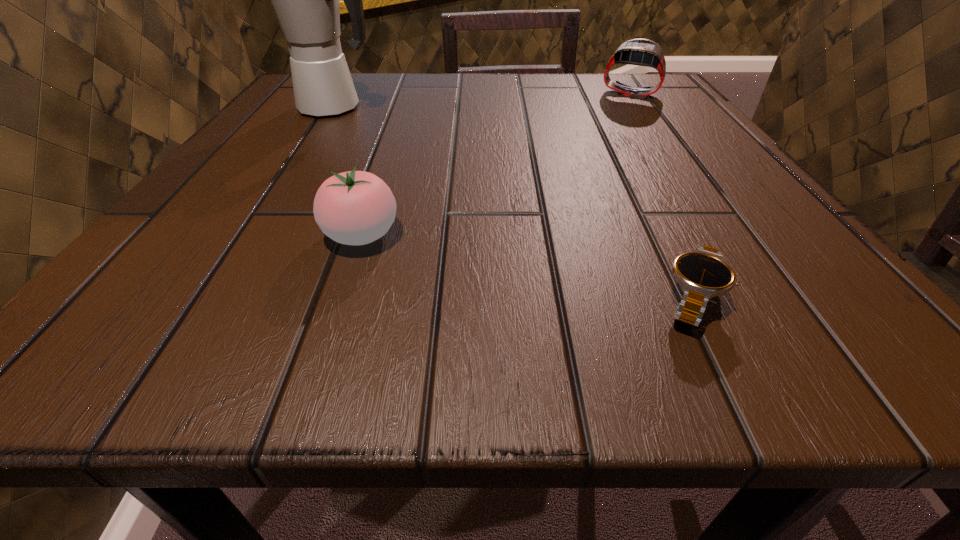
Where is `free space at the near right corner of the desktop`? Image resolution: width=960 pixels, height=540 pixels. free space at the near right corner of the desktop is located at coordinates [x=760, y=299].

The image size is (960, 540). In order to click on free space between the coffeepot and the taller watch in this screenshot , I will do `click(482, 100)`.

You are a GUI agent. You are given a task and a screenshot of the screen. Output one action in this format:
    pyautogui.click(x=<x>, y=<y>)
    Task: Click on the free space between the tomato and the tallest object
    Image resolution: width=960 pixels, height=540 pixels.
    Given the screenshot: What is the action you would take?
    pyautogui.click(x=348, y=171)

Find the location of a particular element. free space between the tallest object and the tomato is located at coordinates (348, 171).

The image size is (960, 540). I want to click on vacant space that's between the tallest object and the tomato, so click(348, 171).

Locate an element on the screen. empty space that is in between the shortest object and the tomato is located at coordinates (527, 267).

Identify the location of unoccupied area between the coffeepot and the tomato. (348, 171).

At what (x,y) coordinates should I click in order to perform the action: click on blank region between the farther watch and the shorter watch. Please return your answer as a coordinate pair (x, y). Looking at the image, I should click on (660, 196).

This screenshot has width=960, height=540. Find the location of `unoccupied position between the second nearest object and the coffeepot`. unoccupied position between the second nearest object and the coffeepot is located at coordinates coord(348,171).

The height and width of the screenshot is (540, 960). Identify the location of free area in between the taller watch and the nearest object. (660, 196).